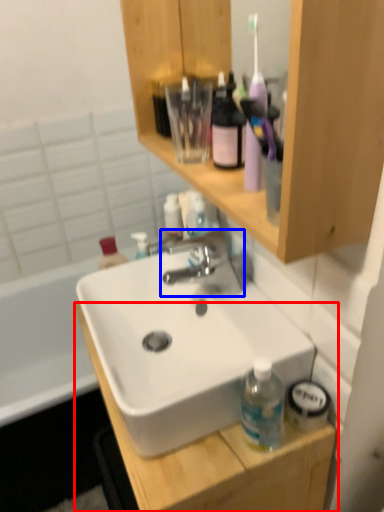
Question: Among these objects, which one is nearest to the camera, cabinetry (highlighted by a red box) or tap (highlighted by a blue box)?

Choices:
 (A) cabinetry
 (B) tap

Answer: (A)